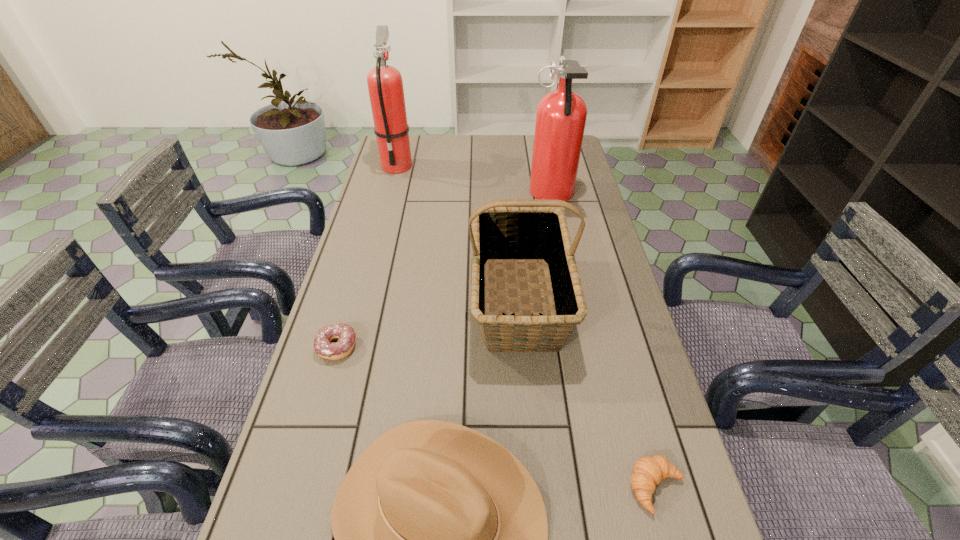
Find the location of a particular element. The width and height of the screenshot is (960, 540). free space in the image that satisfies the following two spatial constraints: 1. on the hose direction of the right fire extinguisher; 2. on the left side of the left fire extinguisher is located at coordinates (389, 195).